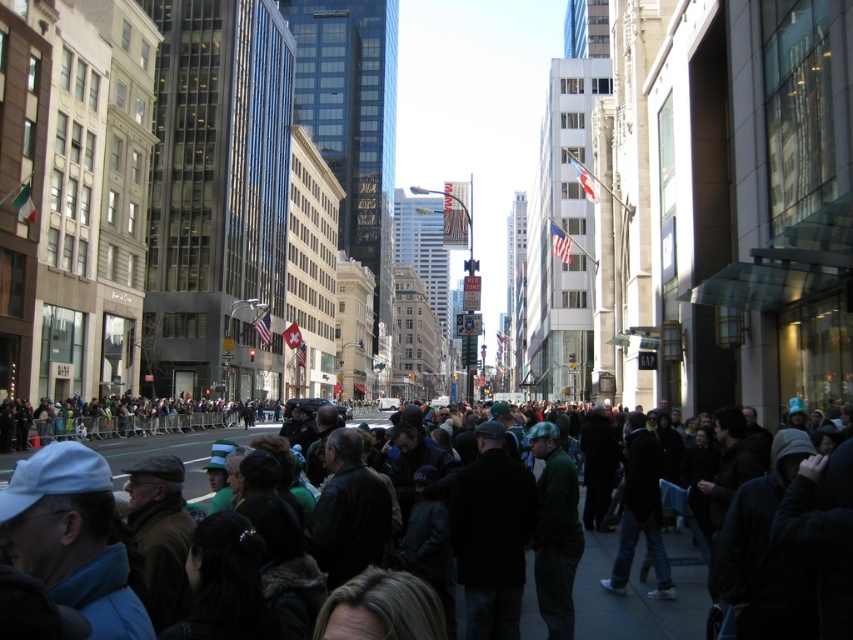
Question: Is dark clothing crowd at center above dark green fabric crowd at lower left?

Choices:
 (A) yes
 (B) no

Answer: (B)

Question: Among these points, which one is farthest from the camera?

Choices:
 (A) (595, 612)
 (B) (62, 417)

Answer: (B)

Question: Is dark clothing crowd at center above dark green fabric crowd at lower left?

Choices:
 (A) yes
 (B) no

Answer: (B)

Question: Is dark clothing crowd at center positioned in front of dark green fabric crowd at lower left?

Choices:
 (A) no
 (B) yes

Answer: (B)

Question: Which point appears farthest from the camera in this image?

Choices:
 (A) (187, 404)
 (B) (635, 589)

Answer: (A)